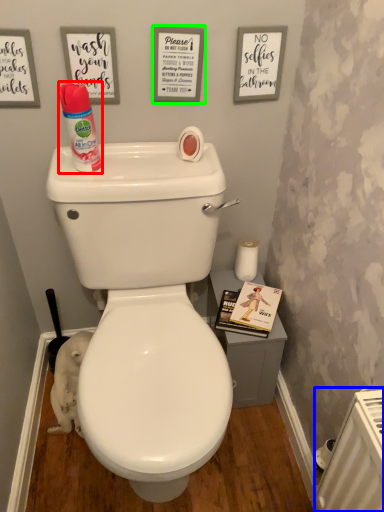
Question: Which is farther away from cleaning product (highlighted by a red box)? radiator (highlighted by a blue box) or copy (highlighted by a green box)?

Choices:
 (A) radiator
 (B) copy

Answer: (A)